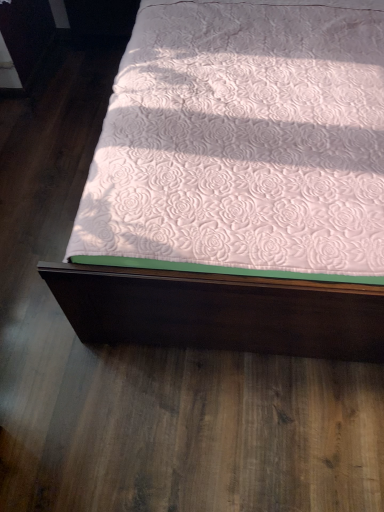
Measure the distance between point (169, 53) and camera.

A distance of 4.93 feet exists between point (169, 53) and camera.

The width and height of the screenshot is (384, 512). Describe the element at coordinates (243, 140) in the screenshot. I see `white quilted fabric at center` at that location.

Measure the distance between white quilted fabric at center and camera.

They are 1.00 meters apart.

Where is `white quilted fabric at center`? Image resolution: width=384 pixels, height=512 pixels. white quilted fabric at center is located at coordinates (243, 140).

Locate an element on the screen. The width and height of the screenshot is (384, 512). white quilted fabric at center is located at coordinates (243, 140).